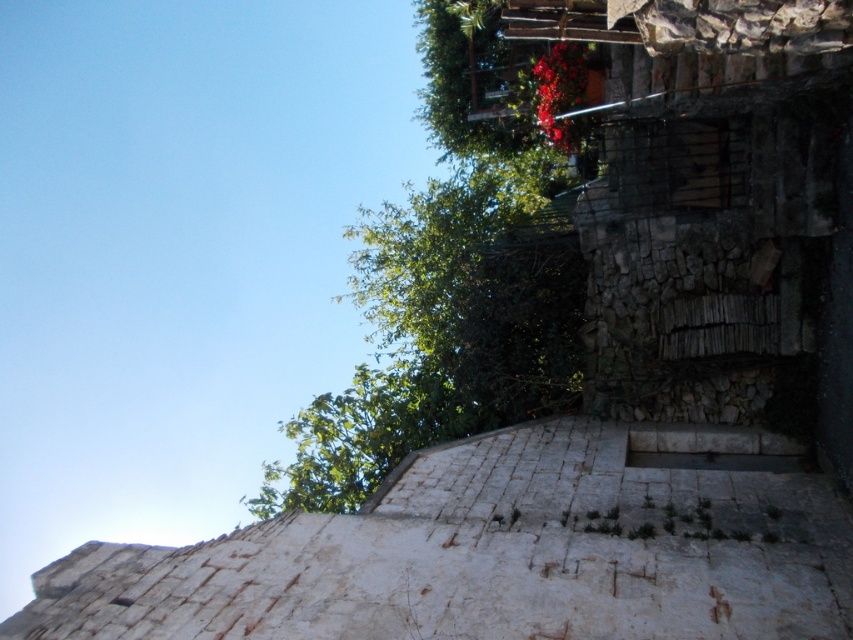
Does green leafy tree at upper center appear over bright red petals at upper center?

No, green leafy tree at upper center is not above bright red petals at upper center.

Is point (405, 304) more distant than point (579, 83)?

That is True.

Locate an element on the screen. green leafy tree at upper center is located at coordinates (450, 291).